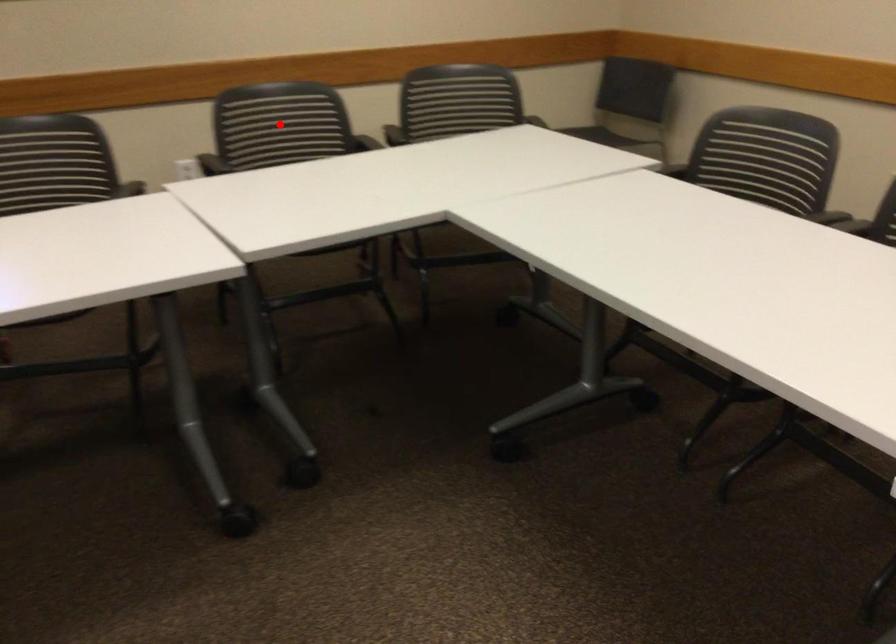
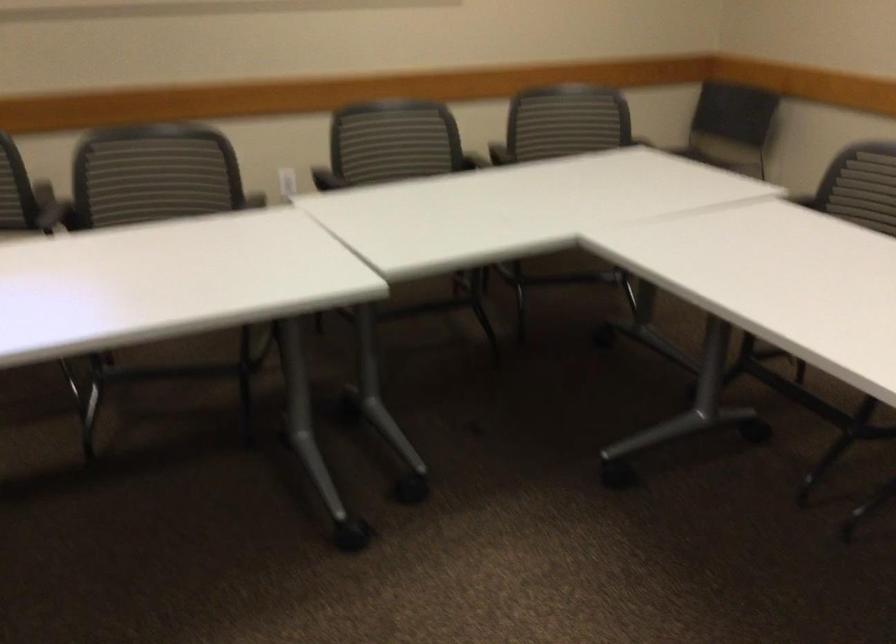
Question: I am providing you with two images of the same scene from different viewpoints. A red point is marked on the first image. At the location where the point appears in image 1, is it still visible in image 2?

Choices:
 (A) Yes
 (B) No

Answer: (B)